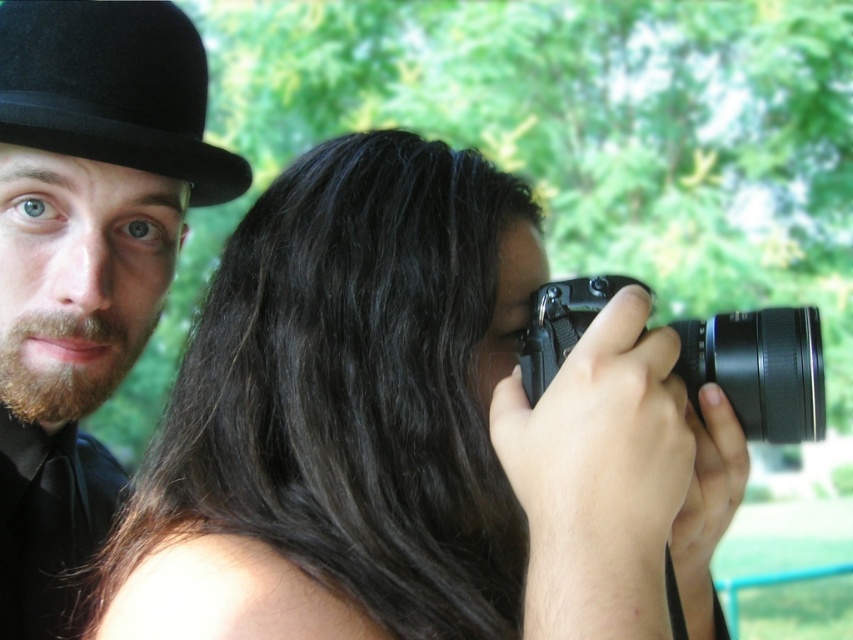
You are an artist trying to sketch the scene. You need to place the black felt bowler hat at upper left in your drawing. What are the coordinates for its position?

The coordinates for the black felt bowler hat at upper left are at point (113, 90).

You are a photographer trying to frame a shot that includes both the black matte bowler hat at upper left and the black plastic camera at center. Given their distance apart, can you fit both into your viewfinder without moving either object?

The black matte bowler hat at upper left and the black plastic camera at center are 15.76 inches apart from each other. Depending on your camera lens and zoom settings, it should be possible to fit both into the viewfinder as 15.76 inches is a manageable distance for most standard framing scenarios.

From the picture: You are a photographer trying to capture a portrait of the man in the black matte bowler hat at upper left. However, the smooth black camera at center is blocking your view. Can you move the camera to the side to get a clear shot of the hat?

The smooth black camera at center is in front of the black matte bowler hat at upper left, so moving the camera to the side would allow you to see the hat clearly.